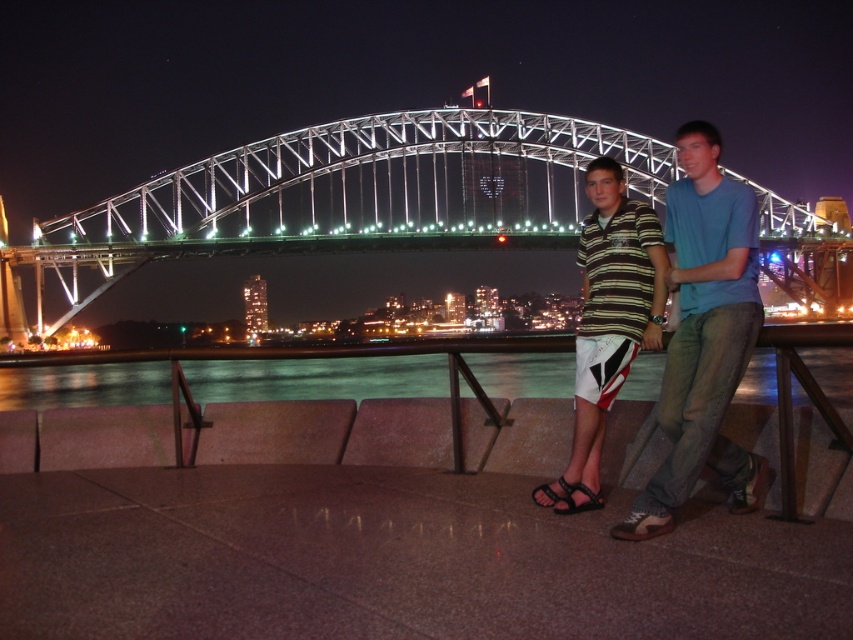
Between blue cotton shirt at center and black rubber sandal at lower center, which one appears on the right side from the viewer's perspective?

blue cotton shirt at center is more to the right.

Does point (737, 310) come behind point (546, 486)?

No, (737, 310) is closer to viewer.

At what (x,y) coordinates should I click in order to perform the action: click on blue cotton shirt at center. Please return your answer as a coordinate pair (x, y). Looking at the image, I should click on (704, 336).

Does metallic steel bridge at center have a greater width compared to striped cotton shirt at center?

Yes, metallic steel bridge at center is wider than striped cotton shirt at center.

Between point (573, 128) and point (650, 346), which one is positioned in front?

Positioned in front is point (650, 346).

Which is in front, point (589, 129) or point (538, 496)?

Point (538, 496) is in front.

This screenshot has width=853, height=640. Identify the location of metallic steel bridge at center. (341, 196).

Is metallic steel bridge at center wider than blue cotton shirt at center?

Yes.

Does metallic steel bridge at center have a larger size compared to blue cotton shirt at center?

Yes, metallic steel bridge at center is bigger than blue cotton shirt at center.

You are a GUI agent. You are given a task and a screenshot of the screen. Output one action in this format:
    pyautogui.click(x=<x>, y=<y>)
    Task: Click on the metallic steel bridge at center
    The height and width of the screenshot is (640, 853).
    Given the screenshot: What is the action you would take?
    pyautogui.click(x=341, y=196)